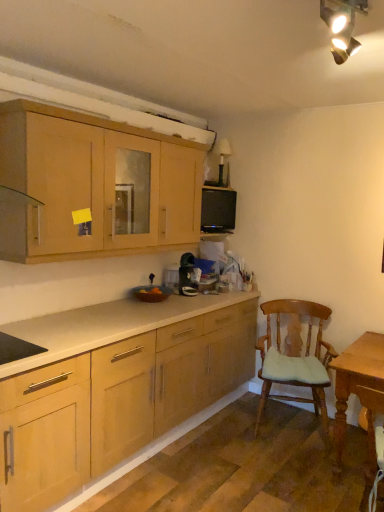
Question: In terms of size, does black matte microwave at upper center appear bigger or smaller than matte wood cabinets at upper left?

Choices:
 (A) small
 (B) big

Answer: (A)

Question: Is black matte microwave at upper center taller or shorter than matte wood cabinets at upper left?

Choices:
 (A) tall
 (B) short

Answer: (B)

Question: Which of these objects is positioned farthest from the black matte microwave at upper center?

Choices:
 (A) light brown wooden table at lower right
 (B) wooden cushioned chair at right
 (C) matte wood cabinets at upper left

Answer: (A)

Question: Which of these objects is positioned farthest from the wooden cushioned chair at right?

Choices:
 (A) light brown wooden table at lower right
 (B) matte wood cabinets at upper left
 (C) black matte microwave at upper center

Answer: (B)